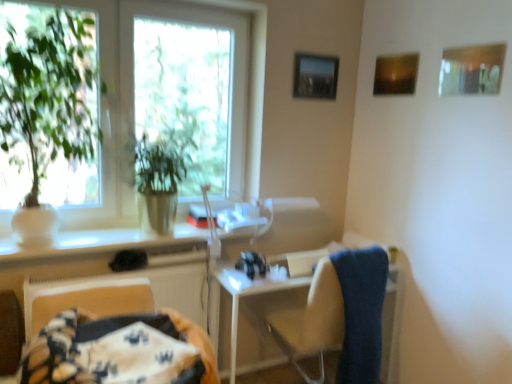
Question: Is matte wooden picture frame at upper right, which is counted as the 2th picture frame, starting from the back, bigger than blue fabric towel at right?

Choices:
 (A) yes
 (B) no

Answer: (B)

Question: Does matte wooden picture frame at upper right, positioned as the 2th picture frame in left-to-right order, have a greater width compared to blue fabric towel at right?

Choices:
 (A) yes
 (B) no

Answer: (B)

Question: From a real-world perspective, is matte wooden picture frame at upper right, positioned as the 2th picture frame in left-to-right order, under blue fabric towel at right?

Choices:
 (A) yes
 (B) no

Answer: (B)

Question: Is matte wooden picture frame at upper right, which is counted as the 2th picture frame, starting from the back, at the right side of blue fabric towel at right?

Choices:
 (A) yes
 (B) no

Answer: (A)

Question: From the image's perspective, would you say matte wooden picture frame at upper right, the second picture frame in the right-to-left sequence, is positioned over blue fabric towel at right?

Choices:
 (A) yes
 (B) no

Answer: (A)

Question: Is matte wooden picture frame at upper right, which is counted as the 2th picture frame, starting from the front, directly adjacent to blue fabric towel at right?

Choices:
 (A) yes
 (B) no

Answer: (B)

Question: Considering the relative sizes of green leafy plant at left and blue fabric towel at right in the image provided, is green leafy plant at left shorter than blue fabric towel at right?

Choices:
 (A) no
 (B) yes

Answer: (A)

Question: Can you confirm if green leafy plant at left is positioned to the left of blue fabric towel at right?

Choices:
 (A) yes
 (B) no

Answer: (A)

Question: Can you confirm if green leafy plant at left is taller than blue fabric towel at right?

Choices:
 (A) yes
 (B) no

Answer: (A)

Question: Does green leafy plant at left have a greater width compared to blue fabric towel at right?

Choices:
 (A) yes
 (B) no

Answer: (B)

Question: Is there a large distance between green leafy plant at left and blue fabric towel at right?

Choices:
 (A) yes
 (B) no

Answer: (A)

Question: Is the depth of green leafy plant at left greater than that of blue fabric towel at right?

Choices:
 (A) yes
 (B) no

Answer: (A)

Question: Does blue fabric towel at right have a greater height compared to green matte plant at left?

Choices:
 (A) yes
 (B) no

Answer: (B)